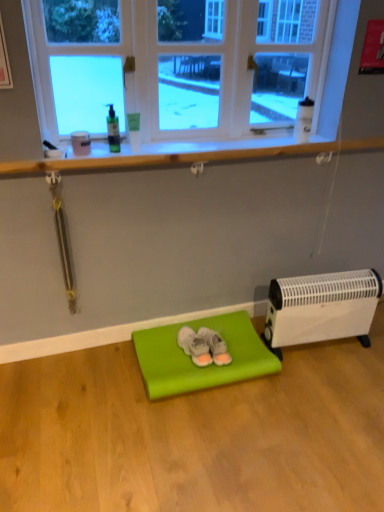
I want to click on vacant space in front of white plastic heater at lower right, so click(x=326, y=390).